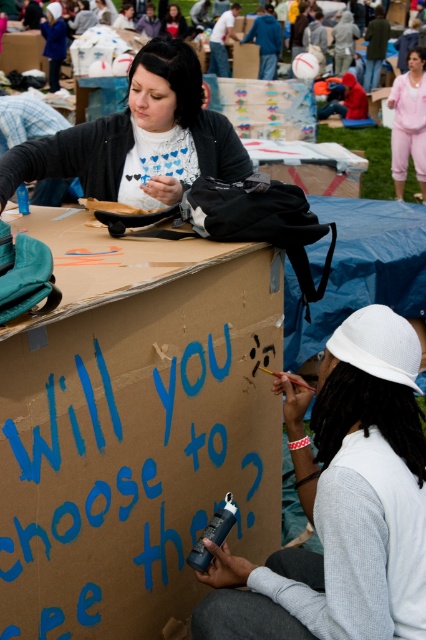
Does blue cardboard box at center have a greater height compared to white matte sweater at upper center?

Correct, blue cardboard box at center is much taller as white matte sweater at upper center.

Which is above, blue cardboard box at center or white matte sweater at upper center?

white matte sweater at upper center is higher up.

Is point (149, 637) less distant than point (0, 209)?

Yes.

This screenshot has height=640, width=426. I want to click on blue cardboard box at center, so click(134, 428).

Does white mesh hat at upper right have a smaller size compared to pink cotton pants at upper right?

Yes.

Who is taller, white mesh hat at upper right or pink cotton pants at upper right?

Standing taller between the two is pink cotton pants at upper right.

At what (x,y) coordinates should I click in order to perform the action: click on white mesh hat at upper right. Please return your answer as a coordinate pair (x, y). This screenshot has height=640, width=426. Looking at the image, I should click on (342, 502).

Is point (141, 83) closer to camera compared to point (170, 22)?

Yes, point (141, 83) is closer to viewer.

Which of these two, white matte sweater at upper center or matte black shirt at upper center, stands taller?

matte black shirt at upper center

Between point (183, 97) and point (181, 24), which one is positioned in front?

Point (183, 97) is more forward.

I want to click on white matte sweater at upper center, so click(x=132, y=131).